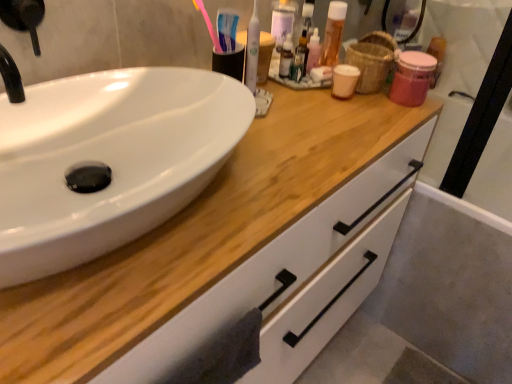
You are a GUI agent. You are given a task and a screenshot of the screen. Output one action in this format:
    pyautogui.click(x=<x>, y=<y>)
    Task: Click on the vacant space to the right of white glossy sink at left
    The height and width of the screenshot is (384, 512).
    Given the screenshot: What is the action you would take?
    pyautogui.click(x=312, y=160)